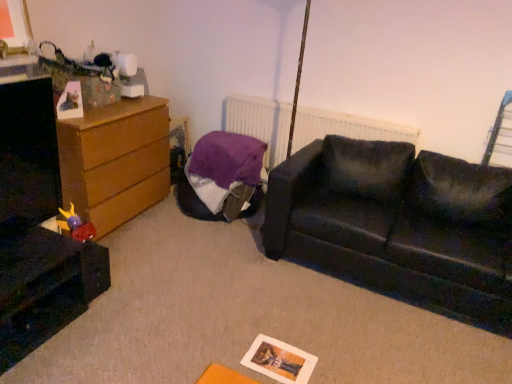
Find the location of `blank space to the left of black leather couch at center`. blank space to the left of black leather couch at center is located at coordinates (199, 279).